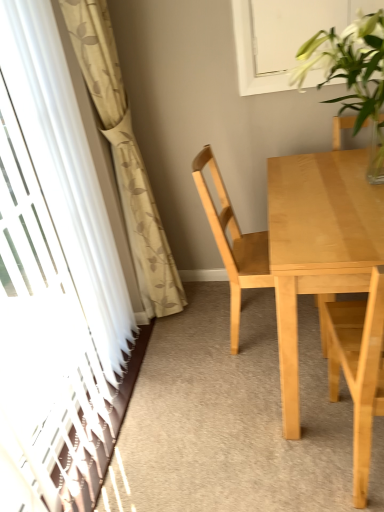
Question: Does light wood chair at right, which appears as the 2th chair when viewed from the back, have a greater height compared to beige floral curtain at left?

Choices:
 (A) no
 (B) yes

Answer: (A)

Question: Does light wood chair at right, which appears as the 2th chair when viewed from the back, turn towards beige floral curtain at left?

Choices:
 (A) no
 (B) yes

Answer: (A)

Question: Is light wood chair at right, arranged as the first chair when viewed from the front, smaller than beige floral curtain at left?

Choices:
 (A) no
 (B) yes

Answer: (B)

Question: Considering the relative sizes of light wood chair at right, arranged as the first chair when viewed from the front, and beige floral curtain at left in the image provided, is light wood chair at right, arranged as the first chair when viewed from the front, bigger than beige floral curtain at left?

Choices:
 (A) no
 (B) yes

Answer: (A)

Question: Does light wood chair at right, which appears as the 2th chair when viewed from the back, come behind beige floral curtain at left?

Choices:
 (A) no
 (B) yes

Answer: (A)

Question: Does light wood chair at right, which appears as the 2th chair when viewed from the back, appear on the right side of beige floral curtain at left?

Choices:
 (A) no
 (B) yes

Answer: (B)

Question: Does transparent plastic screen door at left have a lesser height compared to beige floral curtain at left?

Choices:
 (A) yes
 (B) no

Answer: (B)

Question: Is transparent plastic screen door at left closer to the viewer compared to beige floral curtain at left?

Choices:
 (A) no
 (B) yes

Answer: (B)

Question: Is transparent plastic screen door at left in contact with beige floral curtain at left?

Choices:
 (A) no
 (B) yes

Answer: (A)

Question: Is transparent plastic screen door at left positioned with its back to beige floral curtain at left?

Choices:
 (A) yes
 (B) no

Answer: (B)

Question: Is transparent plastic screen door at left behind beige floral curtain at left?

Choices:
 (A) no
 (B) yes

Answer: (A)

Question: Does transparent plastic screen door at left turn towards beige floral curtain at left?

Choices:
 (A) no
 (B) yes

Answer: (B)

Question: Considering the relative sizes of light wood chair at right, arranged as the first chair when viewed from the front, and transparent plastic screen door at left in the image provided, is light wood chair at right, arranged as the first chair when viewed from the front, wider than transparent plastic screen door at left?

Choices:
 (A) yes
 (B) no

Answer: (A)